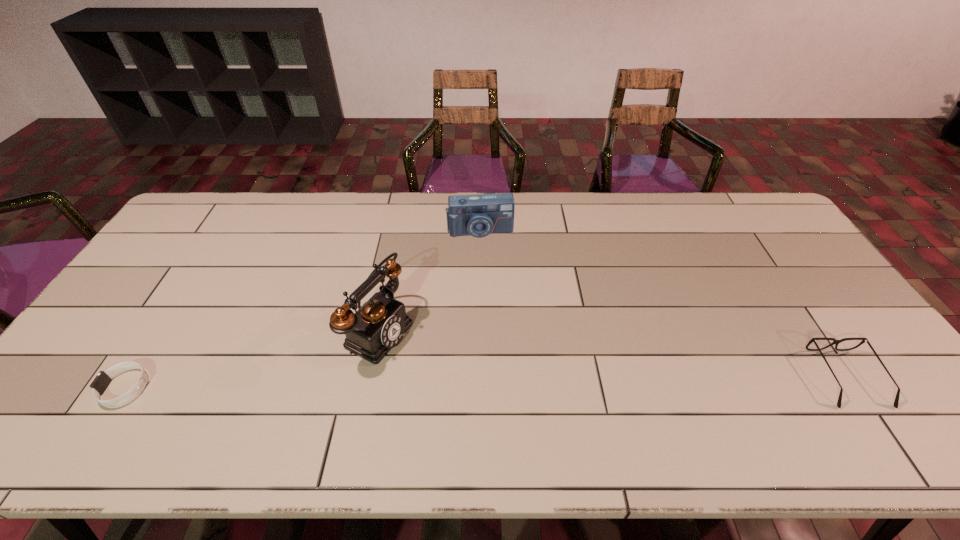
This screenshot has height=540, width=960. In order to click on vacant region located 0.120m on the outer surface of the leftmost object in this screenshot , I will do `click(55, 388)`.

At what (x,y) coordinates should I click in order to perform the action: click on free space located on the lens of the farthest object. Please return your answer as a coordinate pair (x, y). Looking at the image, I should click on (492, 308).

Identify the location of free space located 0.080m on the lens of the farthest object. (485, 256).

This screenshot has height=540, width=960. What are the coordinates of `free region located 0.360m on the lens of the farthest object` in the screenshot? It's located at point(493,324).

This screenshot has width=960, height=540. Identify the location of free point located on the front of the tallest object at the rotary dial. (474, 384).

What are the coordinates of `blank space located on the front of the tallest object at the rotary dial` in the screenshot? It's located at (450, 373).

You are a GUI agent. You are given a task and a screenshot of the screen. Output one action in this format:
    pyautogui.click(x=<x>, y=<y>)
    Task: Click on the vacant area situated 0.220m on the front of the tallest object at the rotary dial
    
    Given the screenshot: What is the action you would take?
    pyautogui.click(x=478, y=386)

Where is `object positioned at the far edge`? This screenshot has height=540, width=960. object positioned at the far edge is located at coordinates (479, 215).

Where is `wristband located at the near edge`? wristband located at the near edge is located at coordinates (103, 379).

Locate an element on the screen. spectacles situated at the near edge is located at coordinates (836, 342).